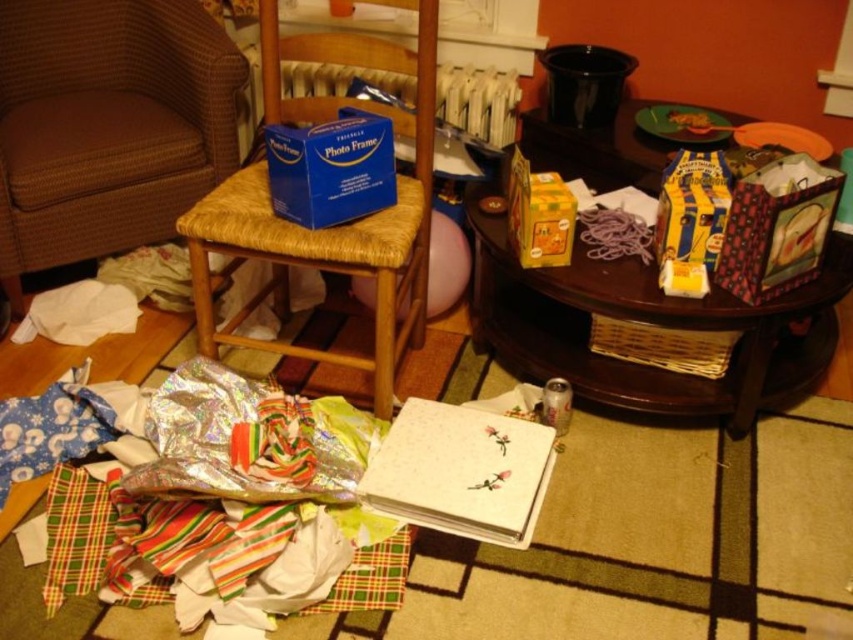
Which is in front, point (511, 342) or point (515, 250)?

Positioned in front is point (515, 250).

Is point (546, 296) behind point (531, 195)?

Yes, point (546, 296) is behind point (531, 195).

I want to click on woodenside table at right, so click(x=653, y=323).

Is point (171, 204) positioned before point (325, 198)?

No, (171, 204) is behind (325, 198).

Between brown woven armchair at left and blue cardboard photo frame at center, which one is positioned lower?

Positioned lower is blue cardboard photo frame at center.

What do you see at coordinates (107, 125) in the screenshot? The height and width of the screenshot is (640, 853). I see `brown woven armchair at left` at bounding box center [107, 125].

Locate an element on the screen. The width and height of the screenshot is (853, 640). brown woven armchair at left is located at coordinates (107, 125).

Is woodenside table at right further to the viewer compared to brown woven chair at left?

That is True.

In the scene shown: Does woodenside table at right appear under brown woven chair at left?

Yes, woodenside table at right is below brown woven chair at left.

Is point (564, 342) positioned in front of point (347, 60)?

No, (564, 342) is behind (347, 60).

Where is `woodenside table at right`? woodenside table at right is located at coordinates (653, 323).